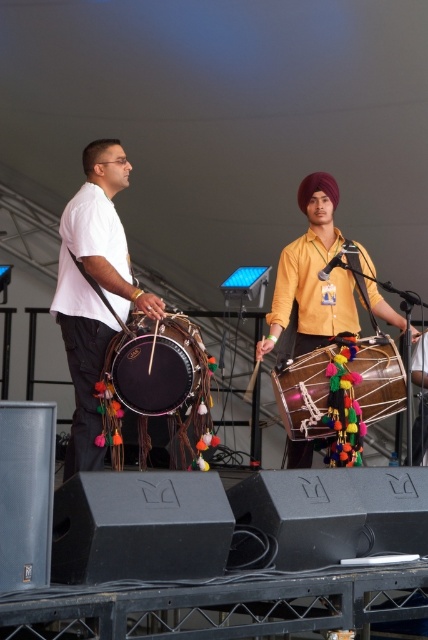
Is matte black drum at center above multicolored fabric drum at center?

Yes.

Is matte black drum at center below multicolored fabric drum at center?

No.

Is point (193, 330) positioned before point (362, 388)?

Yes, point (193, 330) is in front of point (362, 388).

Locate an element on the screen. matte black drum at center is located at coordinates (157, 364).

Is matte yellow shirt at center to the right of multicolored fabric drum at center from the viewer's perspective?

Correct, you'll find matte yellow shirt at center to the right of multicolored fabric drum at center.

Is matte yellow shirt at center wider than multicolored fabric drum at center?

Yes.

Which is in front, point (305, 288) or point (356, 365)?

Positioned in front is point (356, 365).

The image size is (428, 640). Identify the location of matte yellow shirt at center. (312, 276).

Does point (321, 212) come farther from viewer compared to point (165, 392)?

That is True.

Which of these two, matte yellow shirt at center or matte black drum at center, stands shorter?

matte black drum at center

Is point (366, 292) more distant than point (163, 400)?

Yes.

Locate an element on the screen. The height and width of the screenshot is (640, 428). matte yellow shirt at center is located at coordinates (312, 276).